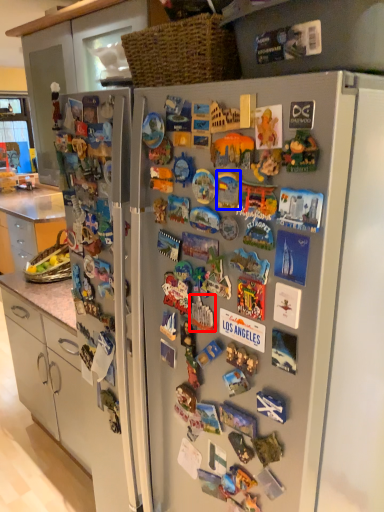
Question: Which of the following is the closest to the observer, toy (highlighted by a red box) or toy (highlighted by a blue box)?

Choices:
 (A) toy
 (B) toy

Answer: (B)